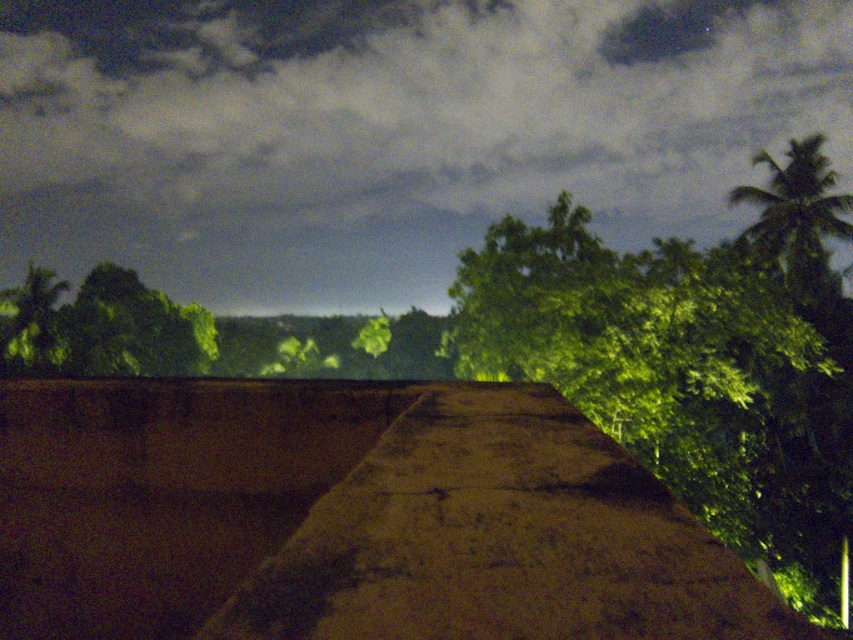
Between dark cloudy sky at upper center and green leafy palm tree at upper right, which one has more height?

dark cloudy sky at upper center

Image resolution: width=853 pixels, height=640 pixels. I want to click on dark cloudy sky at upper center, so click(387, 132).

What are the coordinates of `dark cloudy sky at upper center` in the screenshot? It's located at (387, 132).